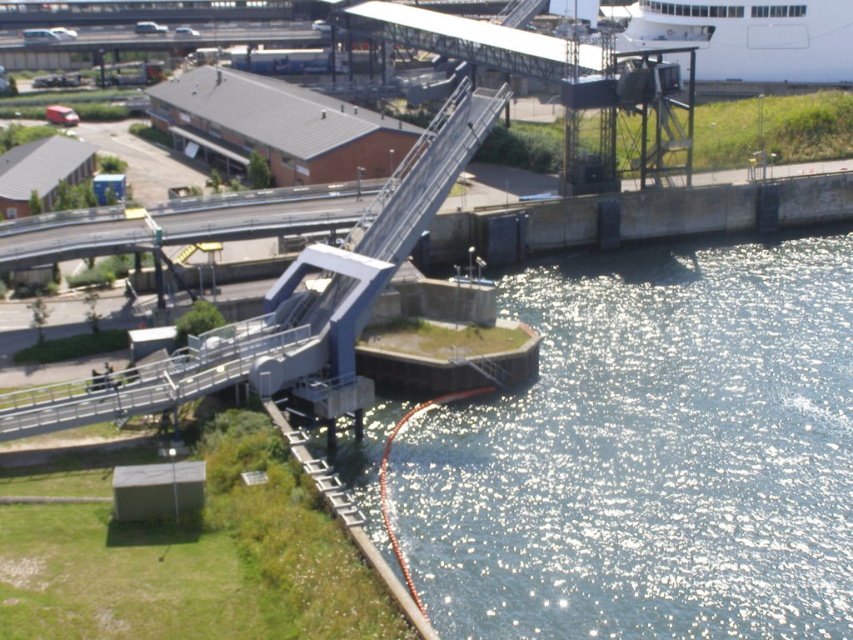
Question: Does shiny metallic water at lower right have a lesser width compared to white glossy cruise ship at upper right?

Choices:
 (A) yes
 (B) no

Answer: (B)

Question: Which object is farther from the camera taking this photo?

Choices:
 (A) shiny metallic water at lower right
 (B) white glossy cruise ship at upper right

Answer: (B)

Question: Observing the image, what is the correct spatial positioning of white glossy cruise ship at upper right in reference to silver metallic rail at lower left?

Choices:
 (A) above
 (B) below

Answer: (A)

Question: Considering the real-world distances, which object is closest to the silver metallic rail at lower left?

Choices:
 (A) white glossy cruise ship at upper right
 (B) shiny metallic water at lower right

Answer: (B)

Question: Which point is closer to the camera?

Choices:
 (A) white glossy cruise ship at upper right
 (B) shiny metallic water at lower right

Answer: (B)

Question: Does shiny metallic water at lower right appear on the left side of silver metallic rail at lower left?

Choices:
 (A) no
 (B) yes

Answer: (A)